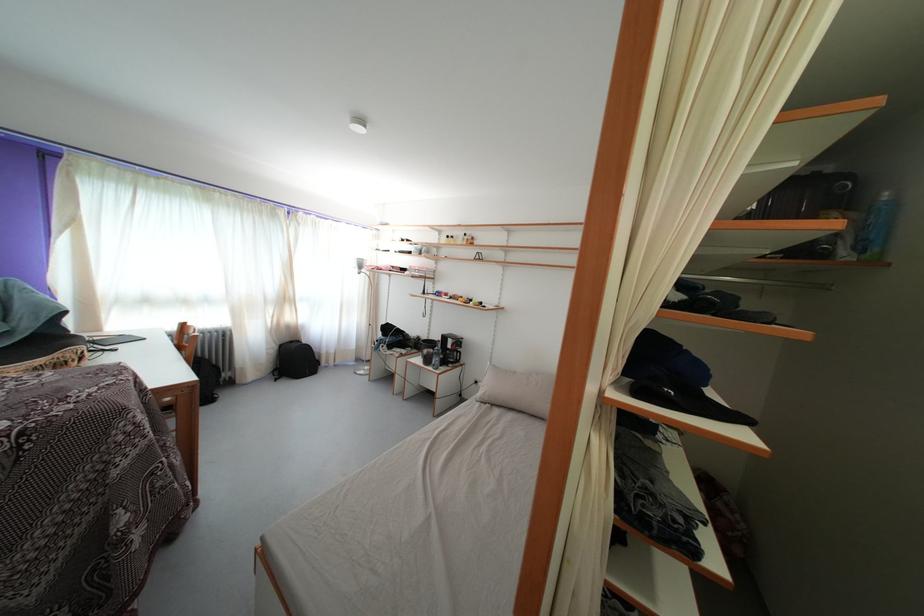
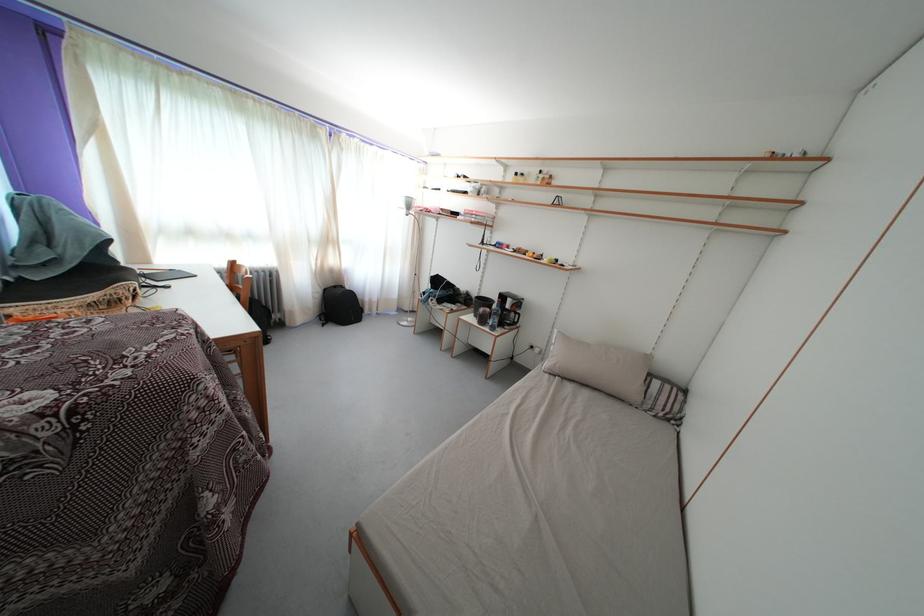
What movement of the cameraman would produce the second image?

The movement direction of the cameraman is left, forward.